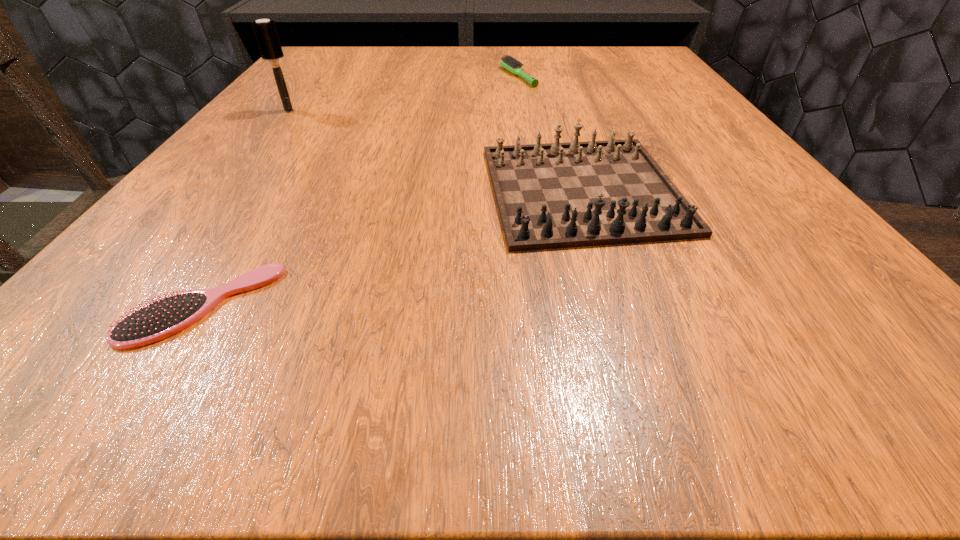
Where is `vacant space that is in between the third farthest object and the second shortest hairbrush`? The height and width of the screenshot is (540, 960). vacant space that is in between the third farthest object and the second shortest hairbrush is located at coordinates (550, 133).

The width and height of the screenshot is (960, 540). Identify the location of free space between the second nearest hairbrush and the nearest hairbrush. (245, 208).

I want to click on the closest object to the second shortest object, so point(558,195).

You are a GUI agent. You are given a task and a screenshot of the screen. Output one action in this format:
    pyautogui.click(x=<x>, y=<y>)
    Task: Click on the closest object to the nearest object
    This screenshot has height=540, width=960.
    Given the screenshot: What is the action you would take?
    click(558, 195)

Find the location of a particular element. hairbrush that stands as the second closest to the farthest hairbrush is located at coordinates (160, 319).

Select which hairbrush is the closest to the shortest hairbrush. Please provide its 2D coordinates. Your answer should be formatted as a tuple, i.e. [(x, y)], where the tuple contains the x and y coordinates of a point satisfying the conditions above.

[(265, 31)]

At what (x,y) coordinates should I click in order to perform the action: click on blank space that satisfies the following two spatial constraints: 1. on the front side of the nearest hairbrush; 2. on the left side of the second farthest object. Please return your answer as a coordinate pair (x, y). The height and width of the screenshot is (540, 960). Looking at the image, I should click on (137, 305).